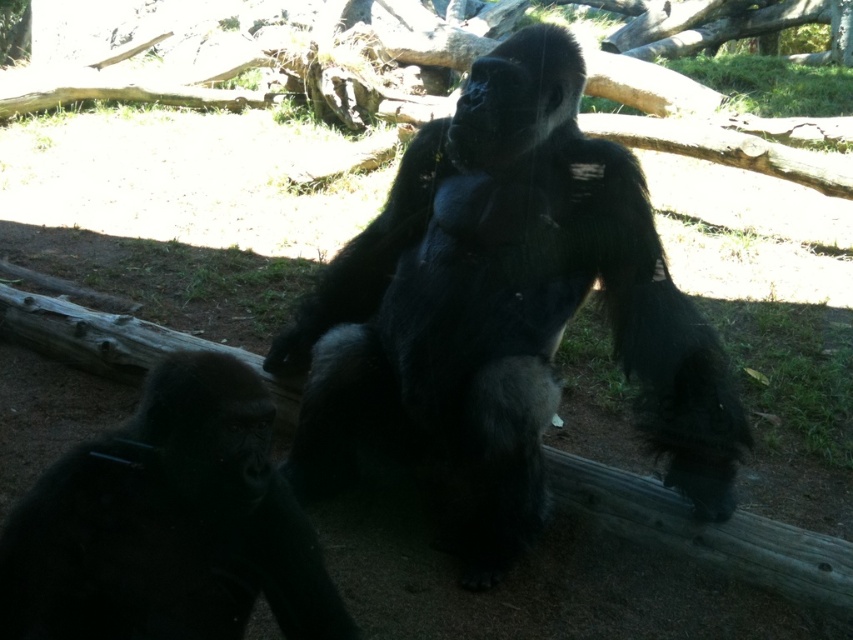
You are a zookeeper observing the enclosure. You need to determine the spatial relationship between the shiny black gorilla at center and the black matte gorilla at lower left. Which gorilla is closer to the front of the enclosure?

The shiny black gorilla at center is closer to the front of the enclosure because the black matte gorilla at lower left is behind it.

You are a zookeeper observing the enclosure. You notice the shiny black gorilla at center and the black matte gorilla at lower left. Which gorilla is positioned to the right of the other?

The shiny black gorilla at center is positioned to the right of the black matte gorilla at lower left.

You are a wildlife photographer standing at the camera position. You want to take a closeup photo of the shiny black gorilla at center. The minimum focusing distance of your camera is 6 feet. Will you be able to take the photo without moving closer?

The shiny black gorilla at center is 7.40 feet away from the camera. Since the minimum focusing distance is 6 feet, you are within the required range and can take the closeup photo without moving closer.